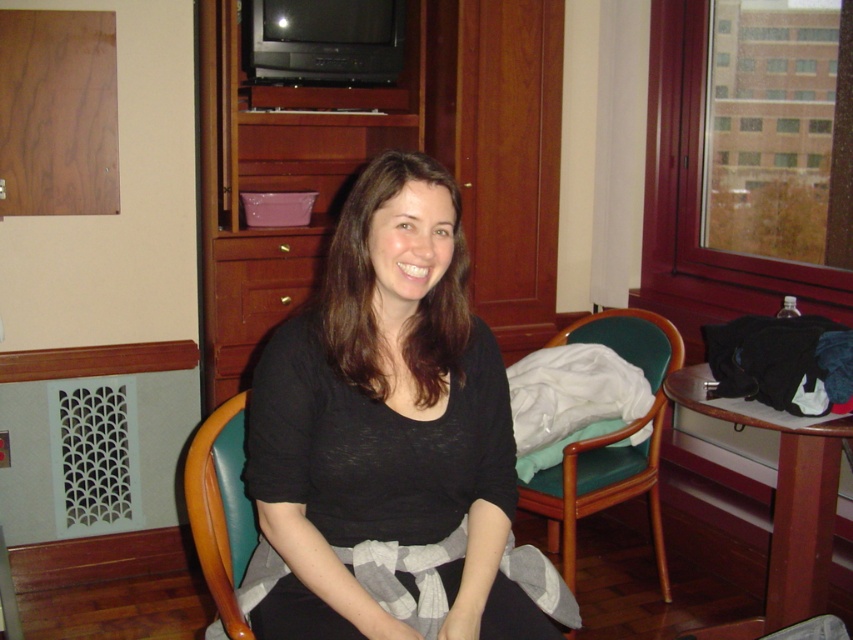
Imagine you are standing at the point labeled point (265, 330) and want to walk towards the point labeled point (660, 536). Based on the scene description, would you be moving towards the background or the foreground of the image?

Since point (660, 536) is behind point (265, 330), moving towards it would mean you are walking towards the background of the image.

You are standing in the room and want to place a small plant on the closest object to you between the teal leather chair at center and the wooden drawer at center. Which object should you choose?

The teal leather chair at center is closer to the viewer than the wooden drawer at center, so you should place the plant on the teal leather chair at center.

You are a guest in this room and need to place a tall lamp that requires a stable surface. The lamp is taller than both the wooden dresser at center and the wooden drawer at center. Which object should you place it on to ensure stability?

The wooden dresser at center is much taller than the wooden drawer at center, so it provides a more stable surface for the tall lamp.